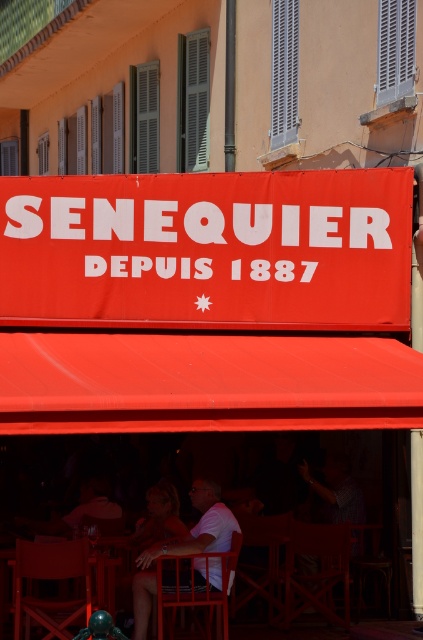
You are standing in front of the restaurant and want to take a photo of both the entrance and the seating area. Which point, point (153,305) or point (107,484), should you focus on first to ensure both areas are in the frame?

Point (153,305) should be focused on first because it is closer to the viewer, allowing the camera to capture both the entrance and the seating area in the frame.

You are standing outside the restaurant and want to take a photo of the red fabric sign at center without including the matte white shirt at lower left in the frame. Is the sign wide enough to be captured without the shirt?

The red fabric sign at center might be wider than matte white shirt at lower left, so there is a possibility that the sign can be captured without including the shirt in the frame.